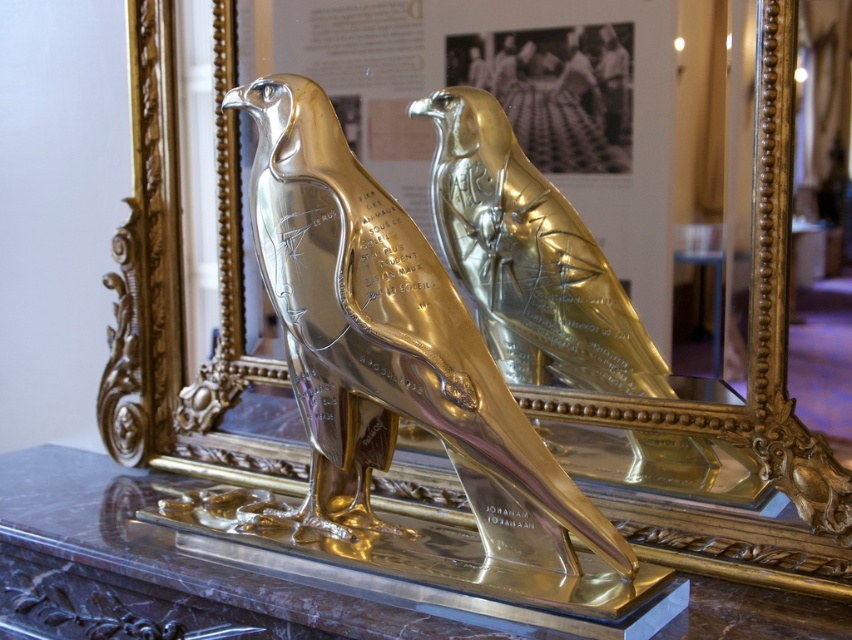
Question: Among these points, which one is nearest to the camera?

Choices:
 (A) (643, 371)
 (B) (308, 230)

Answer: (B)

Question: Can you confirm if shiny gold bird at center is positioned to the left of gold polished eagle at center?

Choices:
 (A) yes
 (B) no

Answer: (A)

Question: Can you confirm if shiny gold bird at center is wider than gold polished eagle at center?

Choices:
 (A) no
 (B) yes

Answer: (B)

Question: Which of the following is the closest to the observer?

Choices:
 (A) gold polished eagle at center
 (B) shiny gold bird at center

Answer: (B)

Question: Does shiny gold bird at center have a greater width compared to gold polished eagle at center?

Choices:
 (A) yes
 (B) no

Answer: (A)